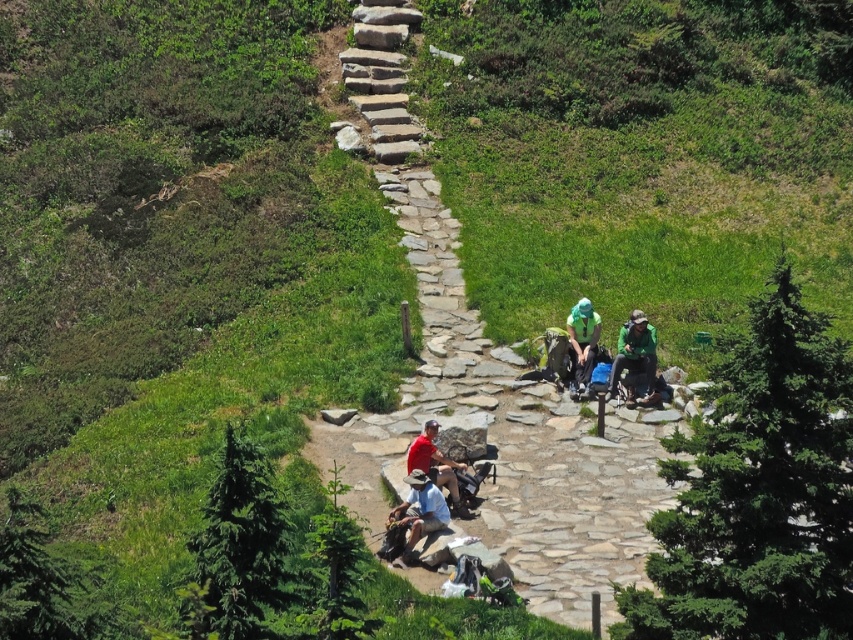
You are standing on the stone pathway and see two points marked on the path. Which point is closer to you, the point at coordinates (584, 268) or the point at (614, 380)?

The point at coordinates (584, 268) is closer to you because it is further to the viewer than the point at (614, 380).